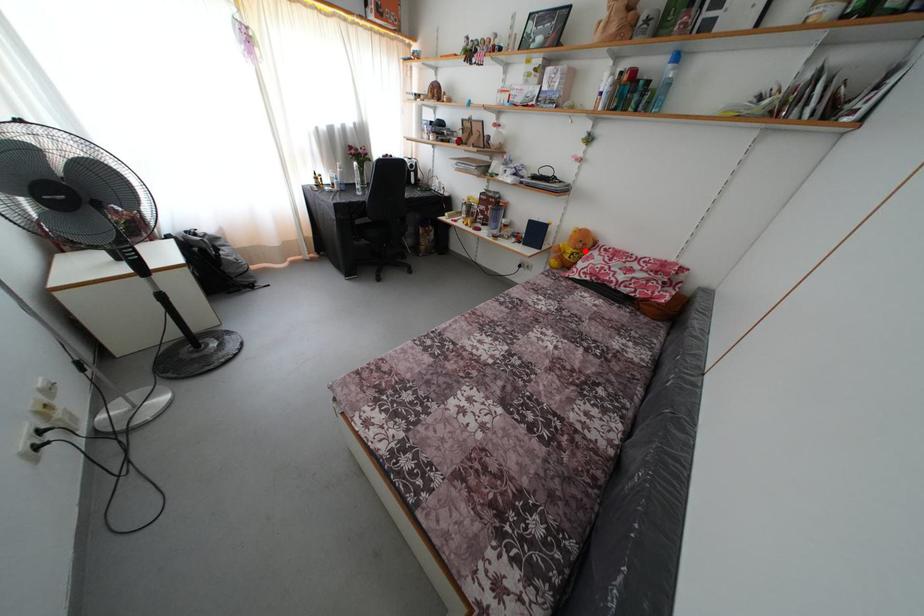
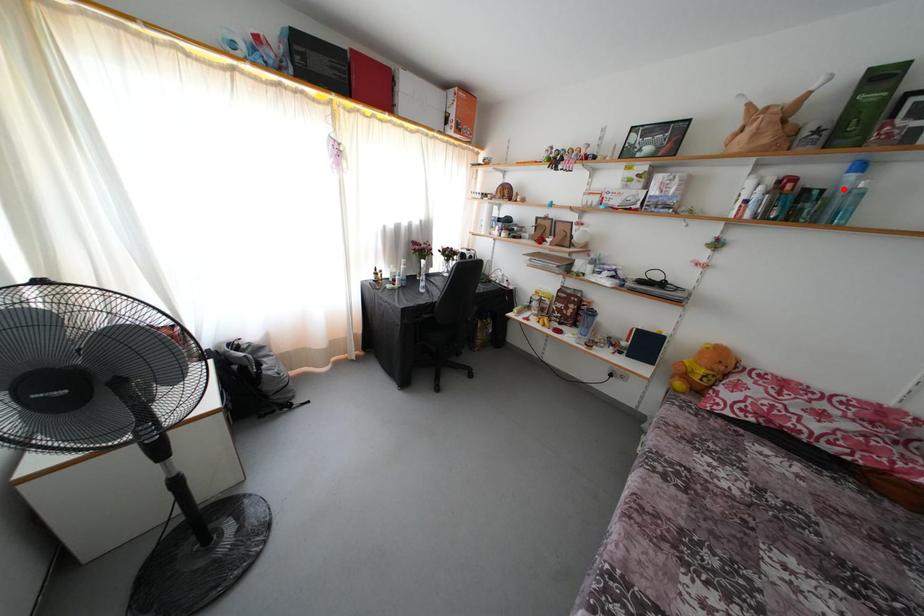
I am providing you with two images of the same scene from different viewpoints. A red point is marked on the first image and another point is marked on the second image. Is the marked point in image1 the same physical position as the marked point in image2?

No